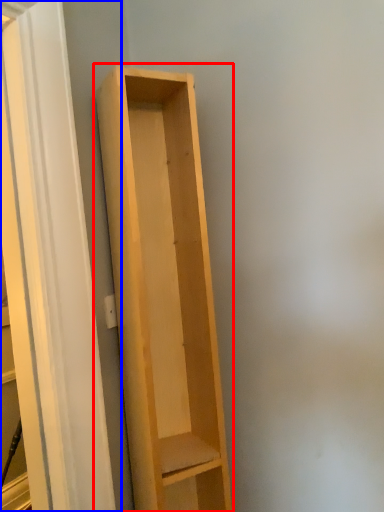
Question: Which point is further to the camera, shelf (highlighted by a red box) or screen door (highlighted by a blue box)?

Choices:
 (A) shelf
 (B) screen door

Answer: (A)